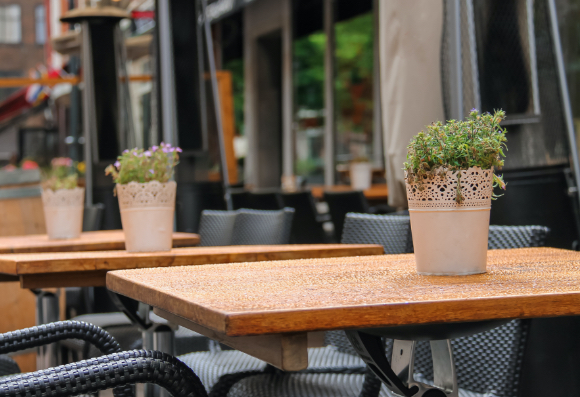
You are a GUI agent. You are given a task and a screenshot of the screen. Output one action in this format:
    pyautogui.click(x=<x>, y=<y>)
    Task: Click on the chairs
    This screenshot has width=580, height=397.
    Given the screenshot: What is the action you would take?
    pyautogui.click(x=487, y=340), pyautogui.click(x=92, y=350), pyautogui.click(x=362, y=215), pyautogui.click(x=211, y=219)